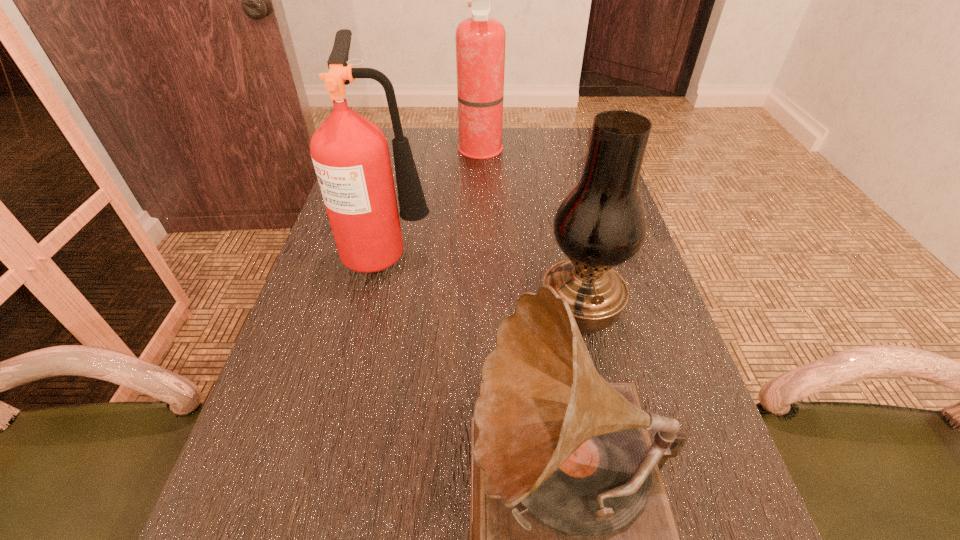
The image size is (960, 540). I want to click on object present at the far edge, so [480, 40].

Locate an element on the screen. The height and width of the screenshot is (540, 960). object that is positioned at the left edge is located at coordinates (350, 154).

This screenshot has height=540, width=960. Find the location of `object located in the right edge section of the desktop`. object located in the right edge section of the desktop is located at coordinates click(600, 224).

Locate an element on the screen. The width and height of the screenshot is (960, 540). vacant space at the far edge of the desktop is located at coordinates (421, 154).

Where is `free location at the left edge`? Image resolution: width=960 pixels, height=540 pixels. free location at the left edge is located at coordinates (342, 341).

Where is `free space at the right edge`? The width and height of the screenshot is (960, 540). free space at the right edge is located at coordinates (646, 279).

Image resolution: width=960 pixels, height=540 pixels. In order to click on free space between the second nearest object and the right fire extinguisher in this screenshot , I will do `click(530, 231)`.

This screenshot has height=540, width=960. Find the location of `free space between the third nearest object and the farther fire extinguisher`. free space between the third nearest object and the farther fire extinguisher is located at coordinates (435, 202).

The image size is (960, 540). In order to click on free point between the leftmost object and the second nearest object in this screenshot , I will do point(485,281).

At what (x,y) coordinates should I click in order to perform the action: click on unoccupied area between the farther fire extinguisher and the leftmost object. Please return your answer as a coordinate pair (x, y). Image resolution: width=960 pixels, height=540 pixels. Looking at the image, I should click on (435, 202).